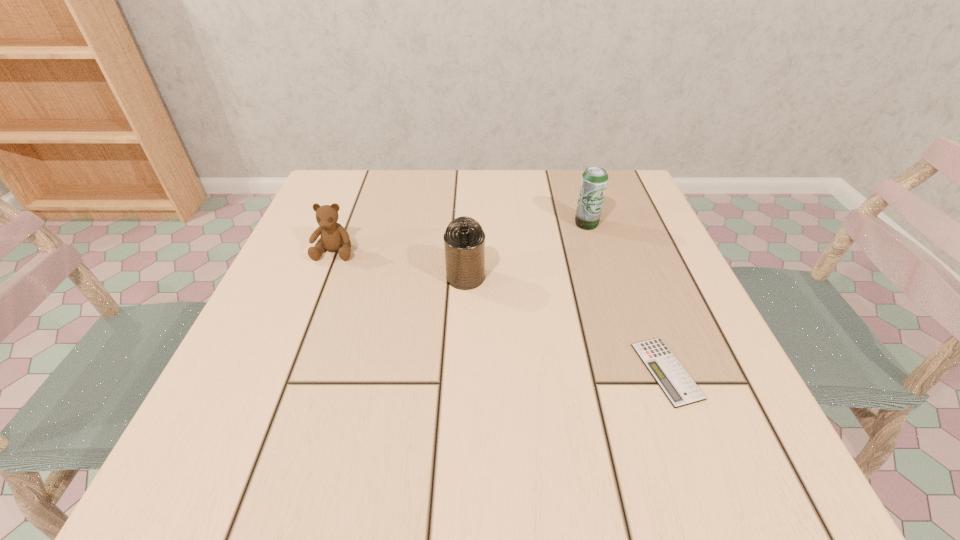
Image resolution: width=960 pixels, height=540 pixels. I want to click on beer can, so click(594, 180).

Find the location of a particular element. This screenshot has width=960, height=540. the third object from right to left is located at coordinates (464, 239).

Find the location of `can`. can is located at coordinates (464, 239).

Identify the location of teddy bear. (334, 237).

The height and width of the screenshot is (540, 960). I want to click on the third nearest object, so click(334, 237).

Identify the location of calculator. (675, 382).

Image resolution: width=960 pixels, height=540 pixels. I want to click on the nearest object, so click(675, 382).

Where is `free region located 0.390m on the front of the farthest object`? free region located 0.390m on the front of the farthest object is located at coordinates (636, 383).

The image size is (960, 540). I want to click on free space located 0.230m on the front of the can, so click(461, 399).

The height and width of the screenshot is (540, 960). I want to click on free region located 0.210m on the front-facing side of the second shortest object, so click(298, 346).